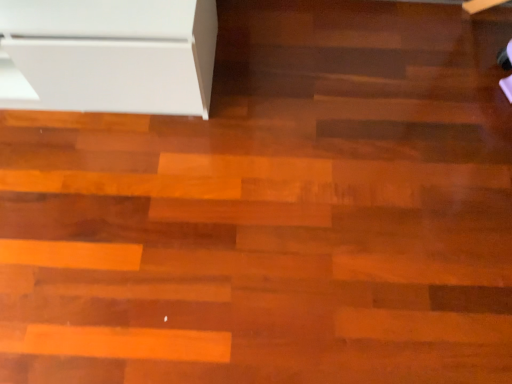
This screenshot has width=512, height=384. In order to click on free location to the right of white glossy cabinet at upper left in this screenshot , I will do `click(286, 94)`.